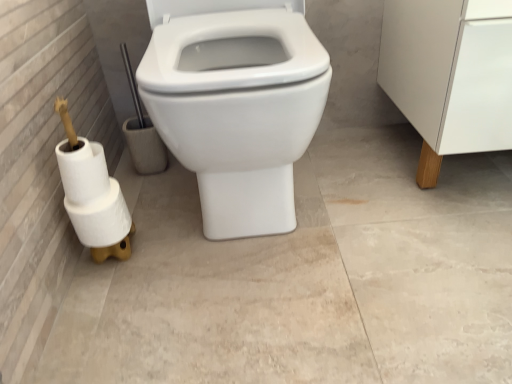
Locate an element on the screen. The image size is (512, 384). free spot to the right of white glossy toilet at center is located at coordinates (374, 196).